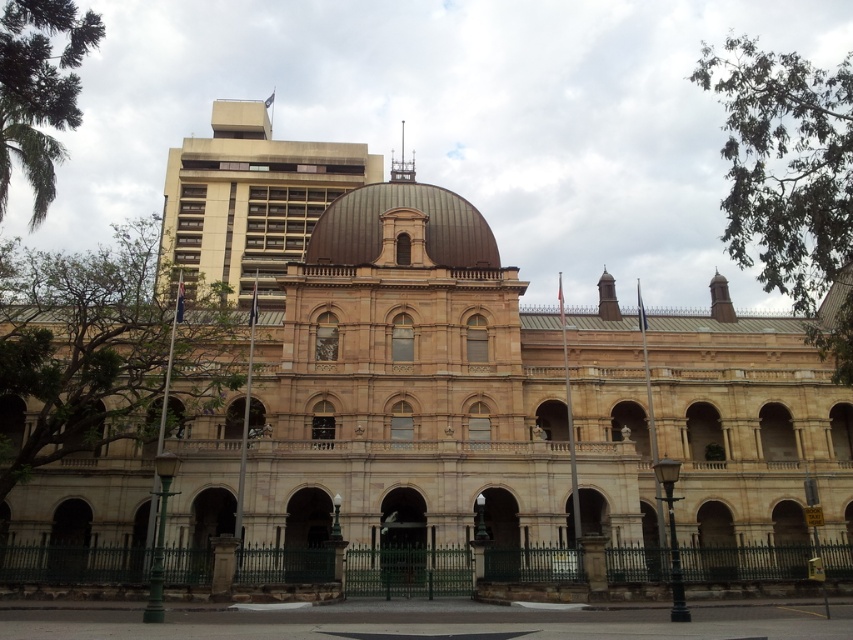
Consider the image. You are an architect analyzing the building structure. You need to determine which dome has a greater width between the beige stone dome at upper center and the brown metallic dome at center. According to the scene description, which one is wider?

The beige stone dome at upper center is wider than the brown metallic dome at center according to the description.

You are standing in front of the historic building and notice two domes. Which dome, the beige stone dome at upper center or the brown metallic dome at center, is positioned to the left of the other?

The beige stone dome at upper center is positioned to the left of the brown metallic dome at center.

Looking at this image, you are standing in front of the historic building and want to determine the arrangement of the domes. Which dome, the beige stone dome at upper center or the brown metallic dome at center, is located higher up?

The beige stone dome at upper center is located higher up because it is positioned over the brown metallic dome at center.